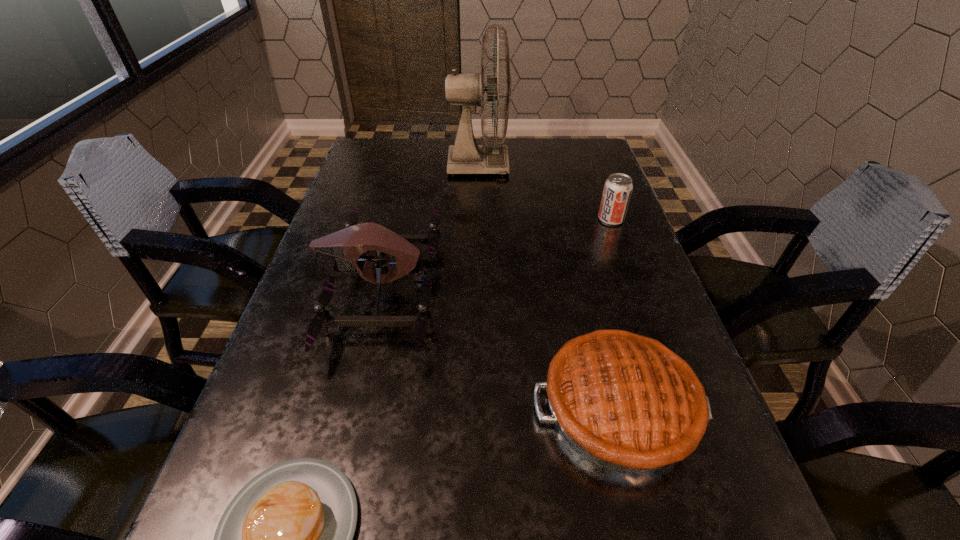
Locate an element on the screen. This screenshot has width=960, height=540. free spot between the pie and the tallest object is located at coordinates (548, 286).

I want to click on empty location between the second tallest object and the pie, so click(500, 348).

Where is `free space between the soda can and the drone`? Image resolution: width=960 pixels, height=540 pixels. free space between the soda can and the drone is located at coordinates (496, 254).

Find the location of a particular element. The width and height of the screenshot is (960, 540). free space between the pie and the soda can is located at coordinates (614, 313).

Locate which object ranks fourth in proximity to the second tallest object. Please provide its 2D coordinates. Your answer should be formatted as a tuple, i.e. [(x, y)], where the tuple contains the x and y coordinates of a point satisfying the conditions above.

[(617, 191)]

The height and width of the screenshot is (540, 960). I want to click on object that can be found as the closest to the pancake, so click(x=347, y=245).

I want to click on free space that satisfies the following two spatial constraints: 1. on the back side of the soda can; 2. on the front-facing side of the fan, so click(x=590, y=165).

This screenshot has height=540, width=960. I want to click on free region that satisfies the following two spatial constraints: 1. on the front side of the fourth nearest object; 2. on the front-facing side of the drone, so click(x=636, y=289).

At what (x,y) coordinates should I click in order to perform the action: click on free point that satisfies the following two spatial constraints: 1. on the front-facing side of the fourth nearest object; 2. on the right side of the tallest object. Please return your answer as a coordinate pair (x, y). The height and width of the screenshot is (540, 960). Looking at the image, I should click on (478, 219).

This screenshot has width=960, height=540. Identify the location of free space that satisfies the following two spatial constraints: 1. on the back side of the pie; 2. on the front-facing side of the fourth shortest object. (588, 289).